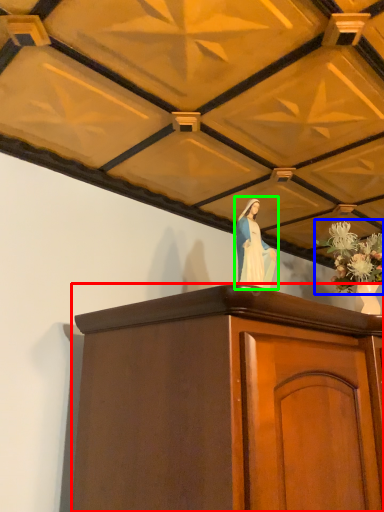
Question: Considering the real-world distances, which object is closest to furniture (highlighted by a red box)? floral arrangement (highlighted by a blue box) or woman (highlighted by a green box).

Choices:
 (A) floral arrangement
 (B) woman

Answer: (B)